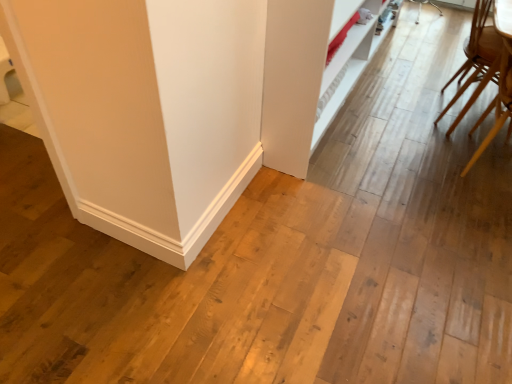
Measure the distance between light brown wooden chair at right and camera.

6.64 feet.

This screenshot has height=384, width=512. Describe the element at coordinates (478, 67) in the screenshot. I see `light brown wooden chair at right` at that location.

Measure the distance between point (481,33) and camera.

Point (481,33) and camera are 2.12 meters apart from each other.

Image resolution: width=512 pixels, height=384 pixels. What are the coordinates of `light brown wooden chair at right` in the screenshot? It's located at (478, 67).

Identify the location of light brown wooden chair at right. This screenshot has height=384, width=512. (478, 67).